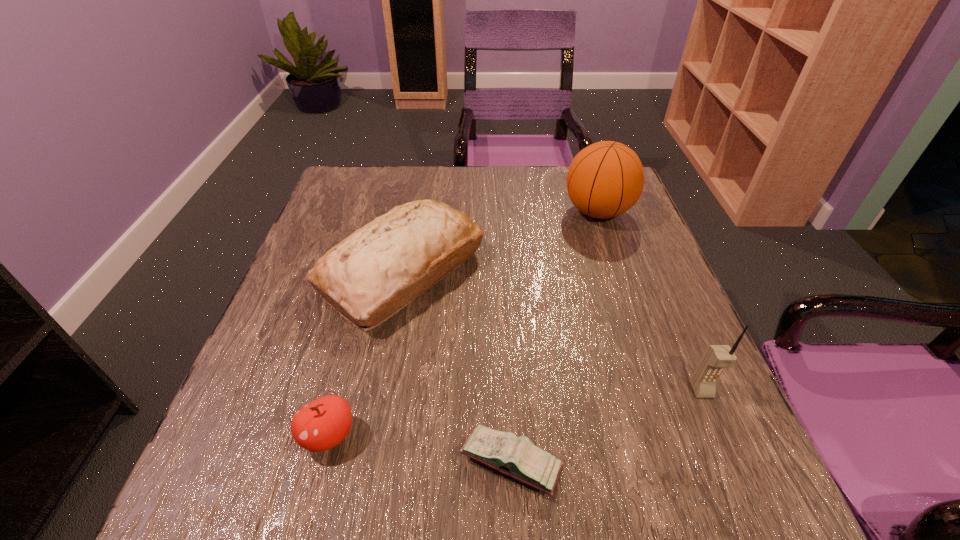
I want to click on vacant area at the far right corner of the desktop, so click(564, 167).

Identify the location of blank region between the shortest object and the basketball. (555, 337).

Identify the location of free spot between the cellular telephone and the basketball. The width and height of the screenshot is (960, 540). (650, 301).

The image size is (960, 540). Find the location of `free space between the basketball and the shortest object`. free space between the basketball and the shortest object is located at coordinates (555, 337).

Where is `free space between the basketball and the third nearest object`? free space between the basketball and the third nearest object is located at coordinates (650, 301).

The width and height of the screenshot is (960, 540). In order to click on vacant space that's between the apple and the bread in this screenshot , I will do `click(366, 354)`.

Locate an element on the screen. Image resolution: width=960 pixels, height=540 pixels. unoccupied area between the apple and the third nearest object is located at coordinates (516, 413).

Locate an element on the screen. The width and height of the screenshot is (960, 540). free space between the basketball and the third farthest object is located at coordinates (650, 301).

You are a GUI agent. You are given a task and a screenshot of the screen. Output one action in this format:
    pyautogui.click(x=<x>, y=<y>)
    Task: Click on the unoccupied position between the basketball and the fourth tallest object
    
    Given the screenshot: What is the action you would take?
    pyautogui.click(x=464, y=323)

Where is `vacant space that's between the apple and the diary`? This screenshot has height=540, width=960. vacant space that's between the apple and the diary is located at coordinates (420, 449).